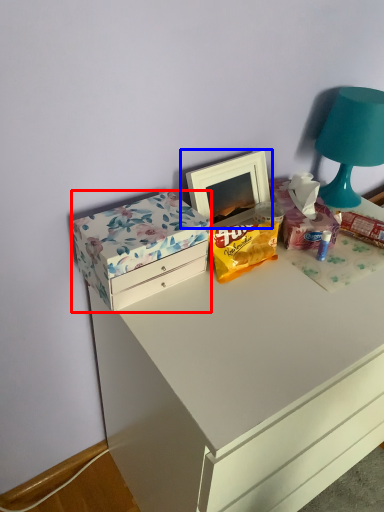
Question: Which of the following is the farthest to the observer, box (highlighted by a red box) or picture frame (highlighted by a blue box)?

Choices:
 (A) box
 (B) picture frame

Answer: (B)